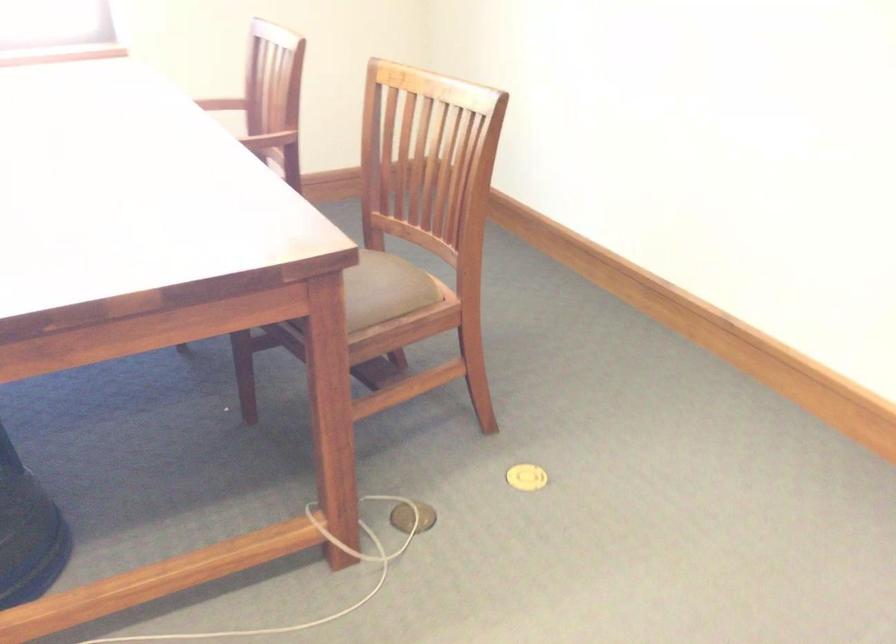
Find where to sit the chair sitting surface. Please return your answer as a coordinate pair (x, y).

(382, 274)